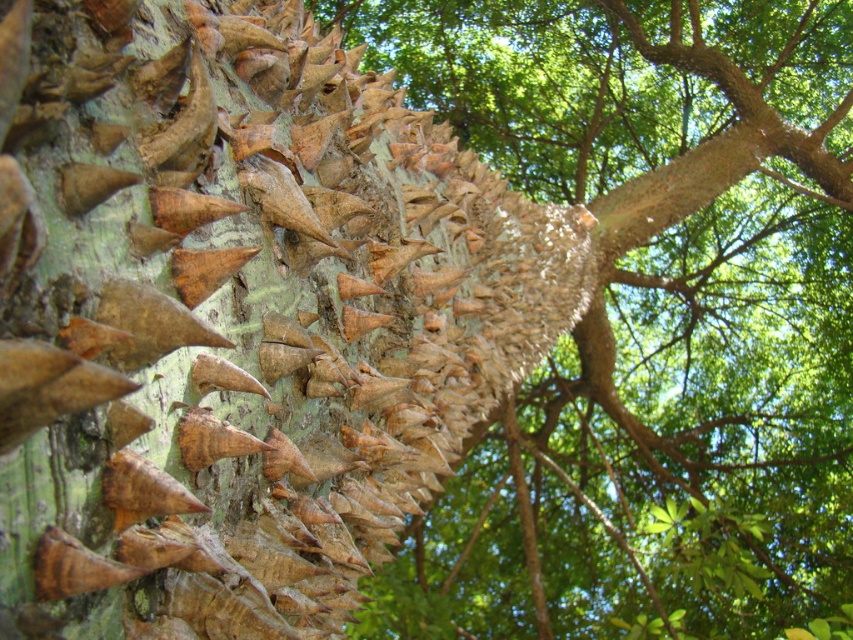
Between green rough bark at center and brown rough bark at center, which one has less height?

Standing shorter between the two is green rough bark at center.

Which is more to the left, green rough bark at center or brown rough bark at center?

From the viewer's perspective, green rough bark at center appears more on the left side.

Who is more distant from viewer, [105,596] or [805,150]?

Positioned behind is point [805,150].

Where is `green rough bark at center`? green rough bark at center is located at coordinates (238, 316).